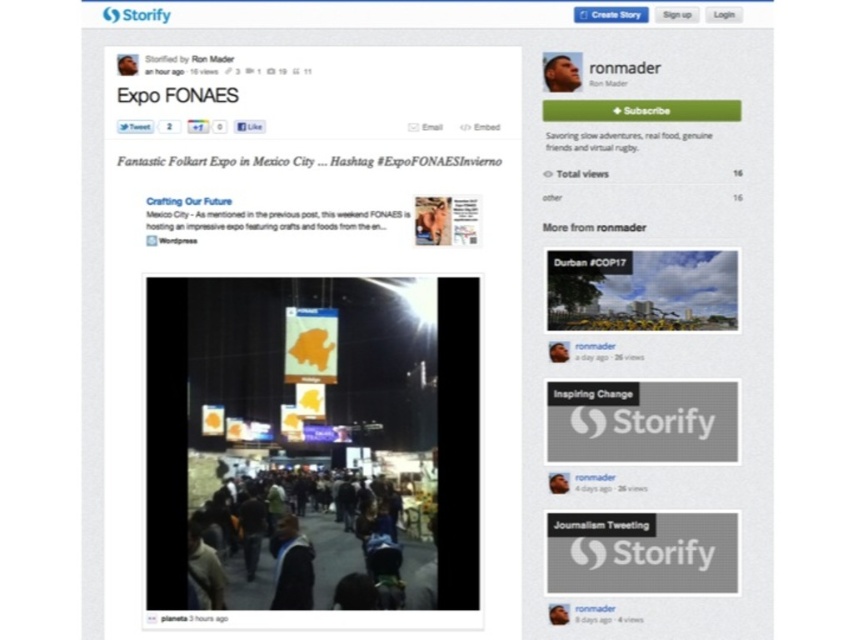
Question: Can you confirm if dark clothing at center is positioned above smooth skin face at upper right?

Choices:
 (A) yes
 (B) no

Answer: (B)

Question: Which is farther from the smooth skin face at upper right?

Choices:
 (A) dark clothing at center
 (B) orange fabric banners at center

Answer: (A)

Question: Does orange fabric banners at center lie behind dark clothing at center?

Choices:
 (A) yes
 (B) no

Answer: (B)

Question: Which object is farther from the camera taking this photo?

Choices:
 (A) smooth skin face at upper right
 (B) orange fabric banners at center

Answer: (A)

Question: Among these objects, which one is nearest to the camera?

Choices:
 (A) smooth skin face at upper right
 (B) orange fabric banners at center

Answer: (B)

Question: Is orange fabric banners at center to the left of smooth skin face at upper right from the viewer's perspective?

Choices:
 (A) yes
 (B) no

Answer: (A)